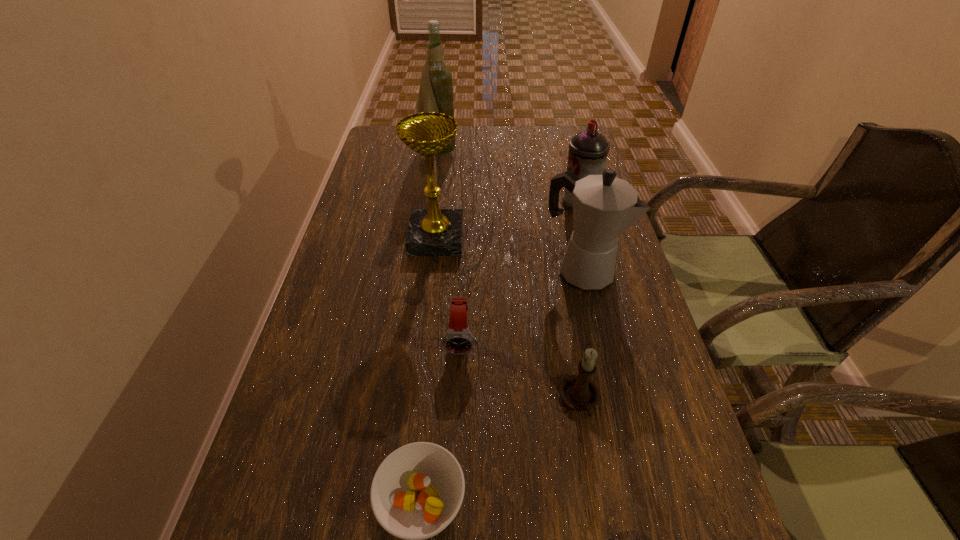
Locate an element on the screen. The height and width of the screenshot is (540, 960). the farthest object is located at coordinates (436, 94).

Locate an element on the screen. wine bottle is located at coordinates (436, 94).

Find the location of a particular element. award is located at coordinates (431, 232).

This screenshot has height=540, width=960. What are the coordinates of `coffeepot` in the screenshot? It's located at (604, 207).

You are a GUI agent. You are given a task and a screenshot of the screen. Output one action in this format:
    pyautogui.click(x=<x>, y=<y>)
    Task: Click on the aerosol can
    This screenshot has height=540, width=960.
    Given the screenshot: What is the action you would take?
    pyautogui.click(x=588, y=150)

Where is `the second nearest object`? The width and height of the screenshot is (960, 540). the second nearest object is located at coordinates (578, 392).

This screenshot has height=540, width=960. What are the coordinates of `the third shortest object` in the screenshot? It's located at [x=578, y=392].

This screenshot has height=540, width=960. Identify the location of the third nearest object. (458, 339).

At what (x,y) coordinates should I click in order to perform the action: click on watch. Please return your answer as a coordinate pair (x, y). The height and width of the screenshot is (540, 960). Looking at the image, I should click on (458, 339).

Identify the location of free space located 0.320m on the front-facing side of the wine bottle. The image size is (960, 540). (553, 154).